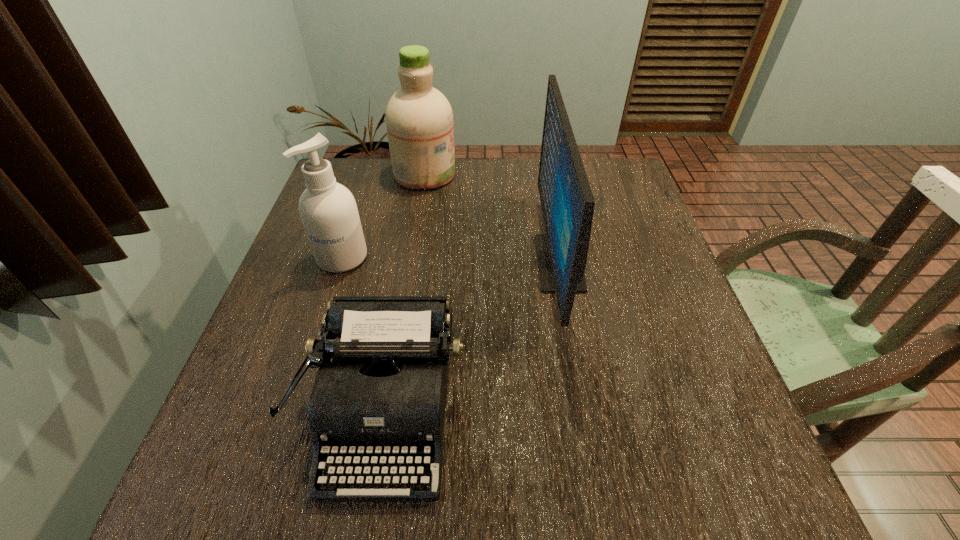
Identify the location of blank region between the rightmost object and the farthest object. This screenshot has height=540, width=960. (492, 218).

Where is `object identified as the second closest to the farthest object`? The width and height of the screenshot is (960, 540). object identified as the second closest to the farthest object is located at coordinates (567, 202).

Select which object is the third closest to the shorter cleansing agent. Please provide its 2D coordinates. Your answer should be formatted as a tuple, i.e. [(x, y)], where the tuple contains the x and y coordinates of a point satisfying the conditions above.

[(567, 202)]

This screenshot has height=540, width=960. I want to click on free space that satisfies the following two spatial constraints: 1. on the front label of the right cleansing agent; 2. on the typing side of the typewriter, so click(x=386, y=413).

I want to click on vacant area in the image that satisfies the following two spatial constraints: 1. on the front label of the farther cleansing agent; 2. on the typing side of the shortest object, so click(x=386, y=413).

In order to click on free space that satisfies the following two spatial constraints: 1. on the front label of the right cleansing agent; 2. on the front label of the nearer cleansing agent in this screenshot , I will do `click(411, 258)`.